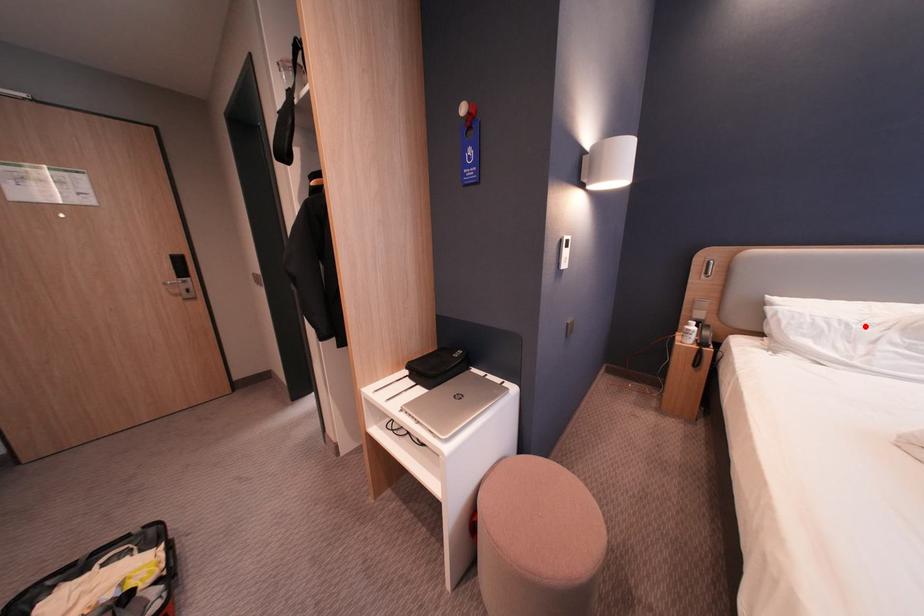
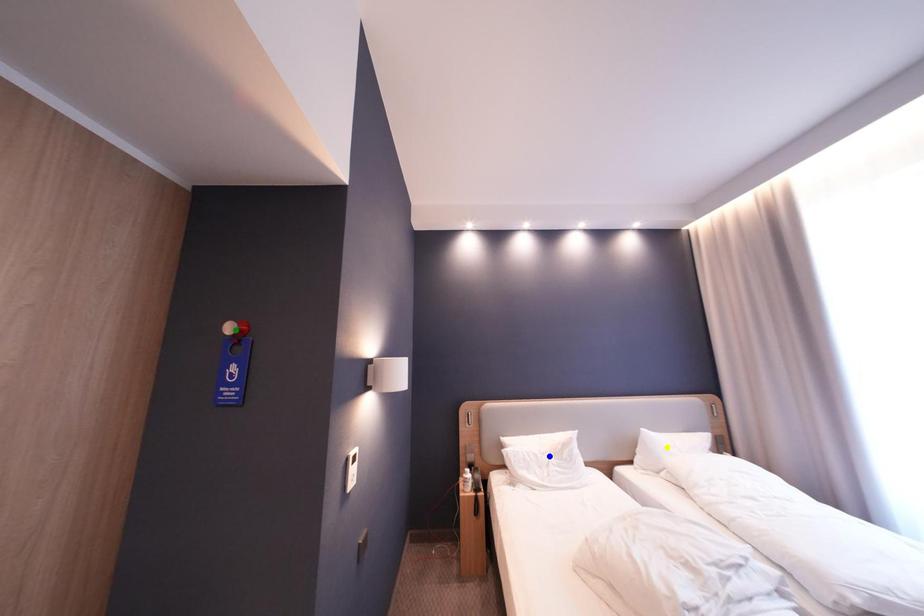
Question: I am providing you with two images of the same scene from different viewpoints. A red point is marked on the first image. You are given multiple points on the second image. Which point in image 2 represents the same 3d spot as the red point in image 1?

Choices:
 (A) yellow point
 (B) green point
 (C) blue point

Answer: (C)